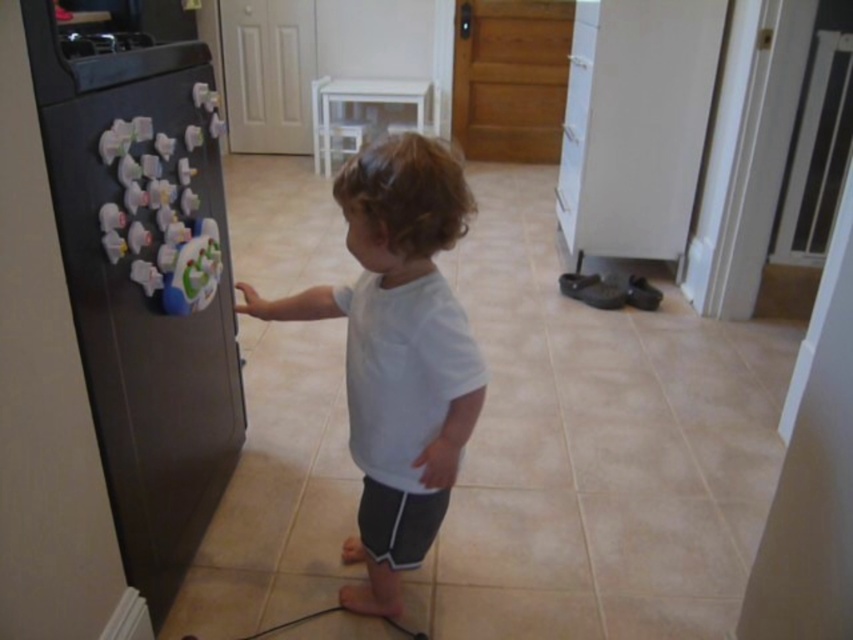
Who is more distant from viewer, (166, 506) or (445, 499)?

Point (166, 506)

Who is more forward, (x=173, y=16) or (x=432, y=211)?

Point (x=432, y=211) is more forward.

Who is more distant from viewer, (68, 134) or (257, 316)?

The point (257, 316) is more distant.

Locate an element on the screen. The image size is (853, 640). black matte refrigerator at left is located at coordinates (143, 264).